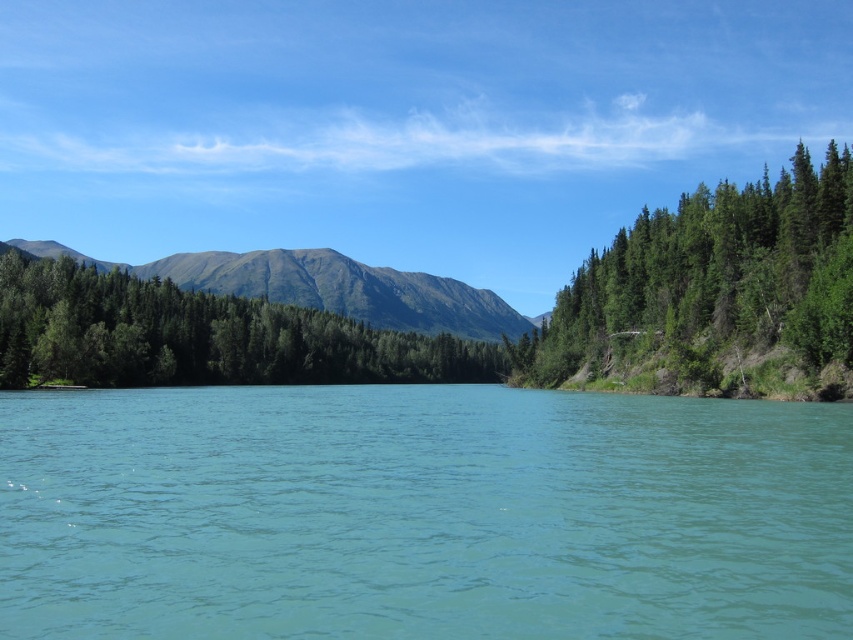
Question: Which point is farther to the camera?

Choices:
 (A) (137, 460)
 (B) (666, 221)

Answer: (B)

Question: Is turquoise liquid at center further to camera compared to green textured trees at right?

Choices:
 (A) yes
 (B) no

Answer: (B)

Question: Does turquoise liquid at center appear on the left side of green textured trees at right?

Choices:
 (A) no
 (B) yes

Answer: (B)

Question: Among these points, which one is farthest from the camera?

Choices:
 (A) (122, 273)
 (B) (322, 509)
 (C) (846, 256)

Answer: (A)

Question: Does turquoise liquid at center have a larger size compared to green textured trees at center?

Choices:
 (A) no
 (B) yes

Answer: (A)

Question: Which object is the farthest from the turquoise liquid at center?

Choices:
 (A) green textured trees at right
 (B) green textured trees at center

Answer: (B)